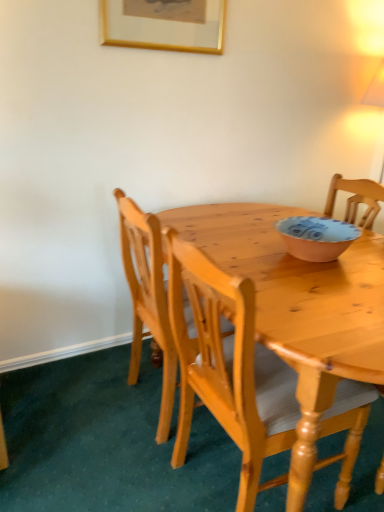
Question: In terms of width, does matte pink bowl at center look wider or thinner when compared to gold-framed picture at upper center?

Choices:
 (A) wide
 (B) thin

Answer: (A)

Question: Considering the relative positions of matte pink bowl at center and gold-framed picture at upper center in the image provided, is matte pink bowl at center to the left or to the right of gold-framed picture at upper center?

Choices:
 (A) right
 (B) left

Answer: (A)

Question: Which of these objects is positioned closest to the light brown wooden chair at center, the first chair positioned from the front?

Choices:
 (A) gold-framed picture at upper center
 (B) light brown wooden chair at center, acting as the 1th chair starting from the back
 (C) matte pink bowl at center

Answer: (B)

Question: Which object is the closest to the light brown wooden chair at center, acting as the 2th chair starting from the back?

Choices:
 (A) light brown wooden chair at center, acting as the 1th chair starting from the back
 (B) gold-framed picture at upper center
 (C) matte pink bowl at center

Answer: (A)